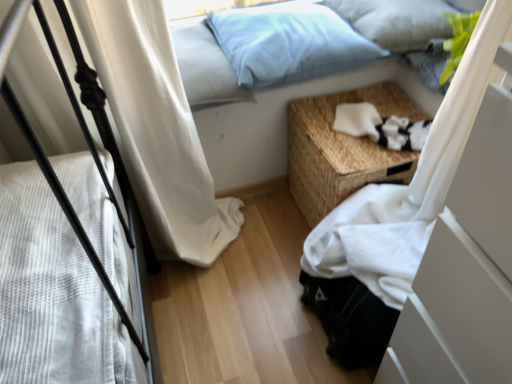
Question: From a real-world perspective, is light blue fabric pillow at upper center, the 1th pillow viewed from the right, below white soft fabric at lower right?

Choices:
 (A) no
 (B) yes

Answer: (A)

Question: Does light blue fabric pillow at upper center, the 1th pillow viewed from the right, turn towards white soft fabric at lower right?

Choices:
 (A) yes
 (B) no

Answer: (B)

Question: From the image's perspective, is light blue fabric pillow at upper center, the 1th pillow viewed from the right, on white soft fabric at lower right?

Choices:
 (A) no
 (B) yes

Answer: (B)

Question: From the image's perspective, is light blue fabric pillow at upper center, the 1th pillow viewed from the right, below white soft fabric at lower right?

Choices:
 (A) yes
 (B) no

Answer: (B)

Question: Is white soft fabric at lower right located within light blue fabric pillow at upper center, the third pillow in the left-to-right sequence?

Choices:
 (A) no
 (B) yes

Answer: (A)

Question: In terms of width, does light blue fabric pillow at upper center, placed as the second pillow when sorted from right to left, look wider or thinner when compared to white fabric at lower right?

Choices:
 (A) wide
 (B) thin

Answer: (B)

Question: From the image's perspective, relative to white fabric at lower right, is light blue fabric pillow at upper center, which is the 2th pillow in left-to-right order, above or below?

Choices:
 (A) above
 (B) below

Answer: (A)

Question: From their relative heights in the image, would you say light blue fabric pillow at upper center, placed as the second pillow when sorted from right to left, is taller or shorter than white fabric at lower right?

Choices:
 (A) tall
 (B) short

Answer: (B)

Question: In terms of size, does light blue fabric pillow at upper center, which is the 2th pillow in left-to-right order, appear bigger or smaller than white fabric at lower right?

Choices:
 (A) big
 (B) small

Answer: (B)

Question: Do you think white soft fabric at lower right is within light blue fabric pillow at upper center, marked as the third pillow in a right-to-left arrangement, or outside of it?

Choices:
 (A) outside
 (B) inside

Answer: (A)

Question: Is white soft fabric at lower right wider or thinner than light blue fabric pillow at upper center, which is the first pillow from left to right?

Choices:
 (A) thin
 (B) wide

Answer: (A)

Question: From a real-world perspective, is white soft fabric at lower right physically located above or below light blue fabric pillow at upper center, which is the first pillow from left to right?

Choices:
 (A) above
 (B) below

Answer: (B)

Question: From their relative heights in the image, would you say white soft fabric at lower right is taller or shorter than light blue fabric pillow at upper center, marked as the third pillow in a right-to-left arrangement?

Choices:
 (A) tall
 (B) short

Answer: (B)

Question: Considering the positions of point (418, 115) and point (237, 23), is point (418, 115) closer or farther from the camera than point (237, 23)?

Choices:
 (A) closer
 (B) farther

Answer: (A)

Question: Looking at the image, does woven wood nightstand at lower right seem bigger or smaller compared to light blue fabric pillow at upper center, which is the 2th pillow in left-to-right order?

Choices:
 (A) big
 (B) small

Answer: (A)